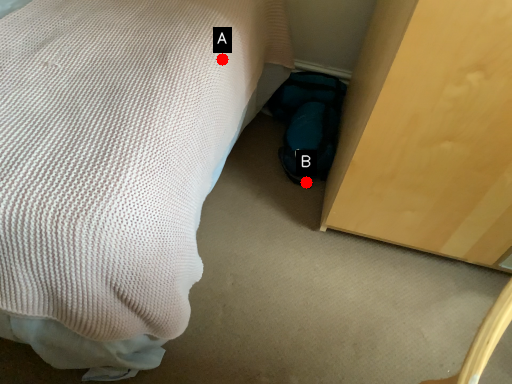
Question: Two points are circled on the image, labeled by A and B beside each circle. Which of the following is the closest to the observer?

Choices:
 (A) A is closer
 (B) B is closer

Answer: (A)